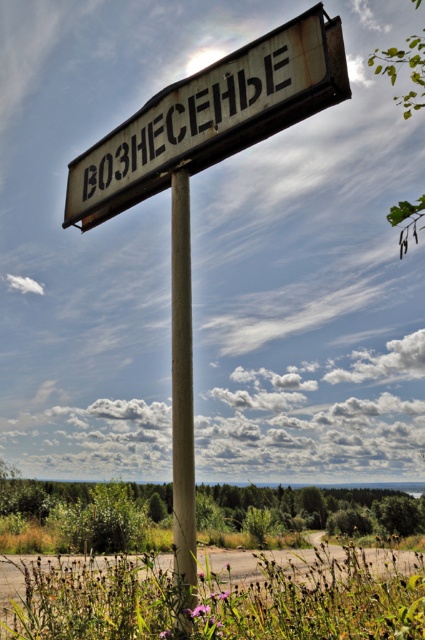
Question: Which point appears closest to the camera in this image?

Choices:
 (A) (186, 248)
 (B) (153, 132)

Answer: (A)

Question: Among these objects, which one is nearest to the camera?

Choices:
 (A) rusty metal sign at upper center
 (B) rusty metal pole at center

Answer: (B)

Question: Where is rusty metal sign at upper center located in relation to rusty metal pole at center in the image?

Choices:
 (A) above
 (B) below

Answer: (A)

Question: Among these points, which one is nearest to the camera?

Choices:
 (A) (180, 540)
 (B) (288, 97)

Answer: (A)

Question: Is rusty metal sign at upper center wider than rusty metal pole at center?

Choices:
 (A) no
 (B) yes

Answer: (B)

Question: Considering the relative positions of rusty metal sign at upper center and rusty metal pole at center in the image provided, where is rusty metal sign at upper center located with respect to rusty metal pole at center?

Choices:
 (A) above
 (B) below

Answer: (A)